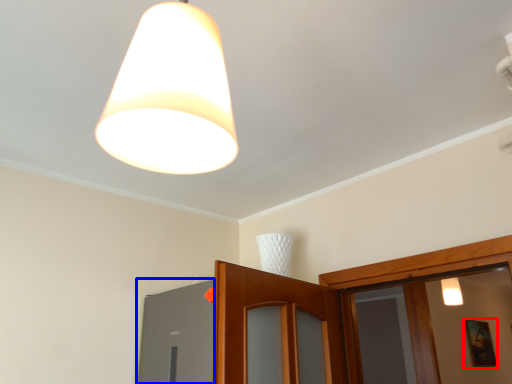
Question: Among these objects, which one is nearest to the camera, picture frame (highlighted by a red box) or window (highlighted by a blue box)?

Choices:
 (A) picture frame
 (B) window

Answer: (B)